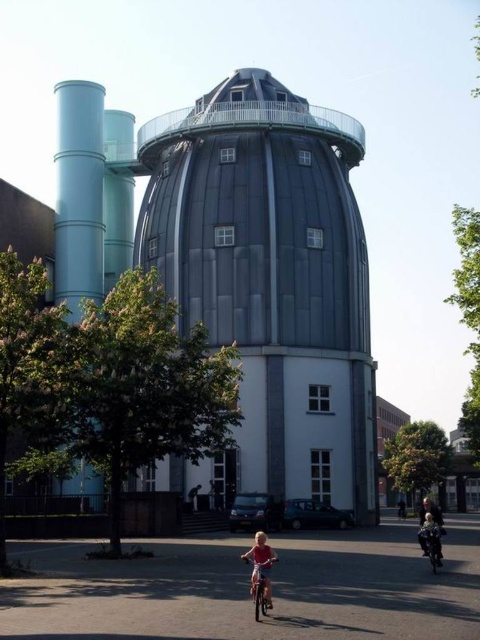
The image size is (480, 640). I want to click on metallic gray observatory at center, so click(x=254, y=264).

Which of these two, metallic gray observatory at center or light blue fabric jacket at lower right, stands taller?

Standing taller between the two is metallic gray observatory at center.

Where is `metallic gray observatory at center`? The height and width of the screenshot is (640, 480). metallic gray observatory at center is located at coordinates (254, 264).

Can you confirm if matte pink shirt at lower center is positioned above light blue fabric jacket at lower right?

Correct, matte pink shirt at lower center is located above light blue fabric jacket at lower right.

Based on the photo, is matte pink shirt at lower center to the left of light blue fabric jacket at lower right from the viewer's perspective?

Indeed, matte pink shirt at lower center is positioned on the left side of light blue fabric jacket at lower right.

Is point (267, 566) farther from camera compared to point (435, 515)?

No, (267, 566) is closer to viewer.

Where is `matte pink shirt at lower center`? This screenshot has height=640, width=480. matte pink shirt at lower center is located at coordinates [261, 564].

Can you confirm if metallic gray observatory at center is bigger than matte pink shirt at lower center?

Correct, metallic gray observatory at center is larger in size than matte pink shirt at lower center.

Can you confirm if metallic gray observatory at center is positioned below matte pink shirt at lower center?

Actually, metallic gray observatory at center is above matte pink shirt at lower center.

This screenshot has height=640, width=480. In order to click on metallic gray observatory at center in this screenshot , I will do `click(254, 264)`.